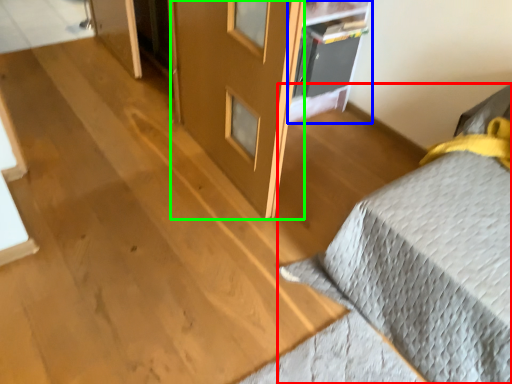
Question: Considering the real-world distances, which object is closest to furniture (highlighted by a red box)? shelf (highlighted by a blue box) or screen door (highlighted by a green box).

Choices:
 (A) shelf
 (B) screen door

Answer: (B)